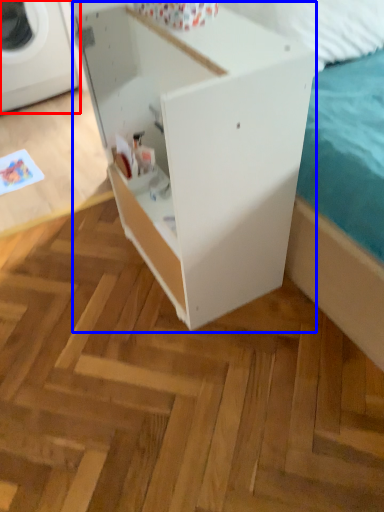
Question: Which object appears closest to the camera in this image, washing machine (highlighted by a red box) or furniture (highlighted by a blue box)?

Choices:
 (A) washing machine
 (B) furniture

Answer: (B)